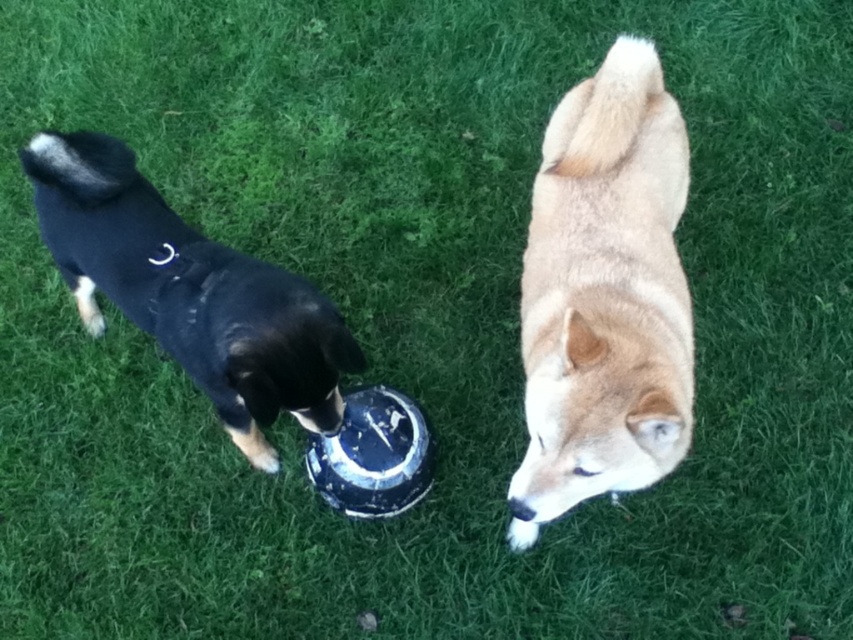
Which is in front, point (668, 397) or point (241, 420)?

Point (668, 397)

Is light brown fur dog at upper right further to the viewer compared to black matte dog at left?

No, light brown fur dog at upper right is in front of black matte dog at left.

Which is behind, point (553, 470) or point (267, 278)?

The point (267, 278) is more distant.

Locate an element on the screen. Image resolution: width=853 pixels, height=640 pixels. light brown fur dog at upper right is located at coordinates (604, 296).